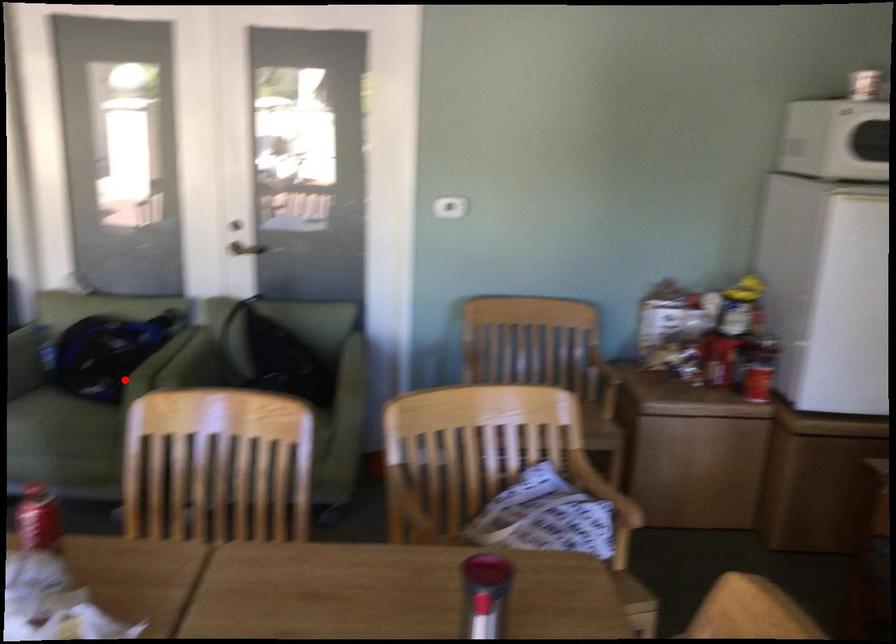
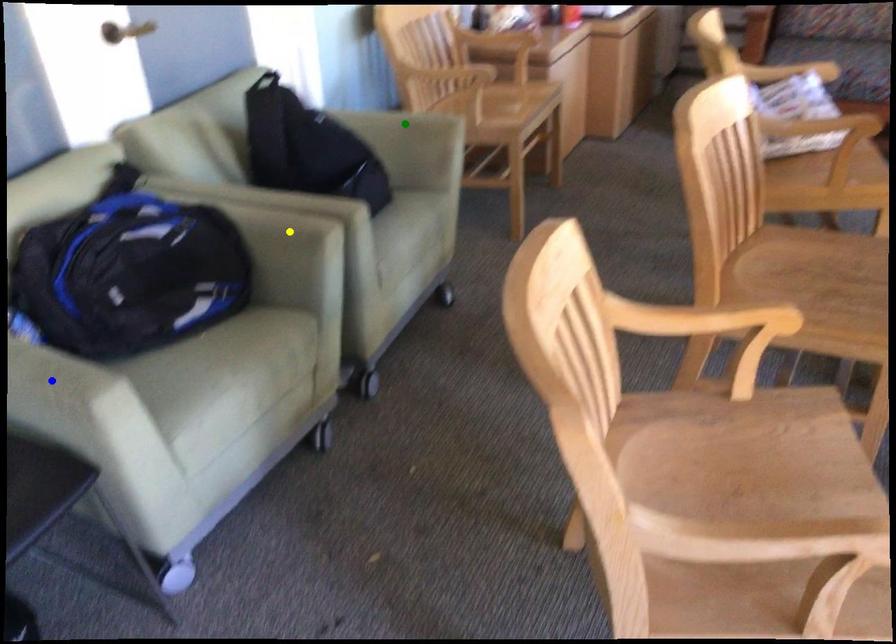
Question: I am providing you with two images of the same scene from different viewpoints. A red point is marked on the first image. You are given multiple points on the second image. Which mark in image 2 goes with the point in image 1?

Choices:
 (A) green point
 (B) yellow point
 (C) blue point

Answer: (B)